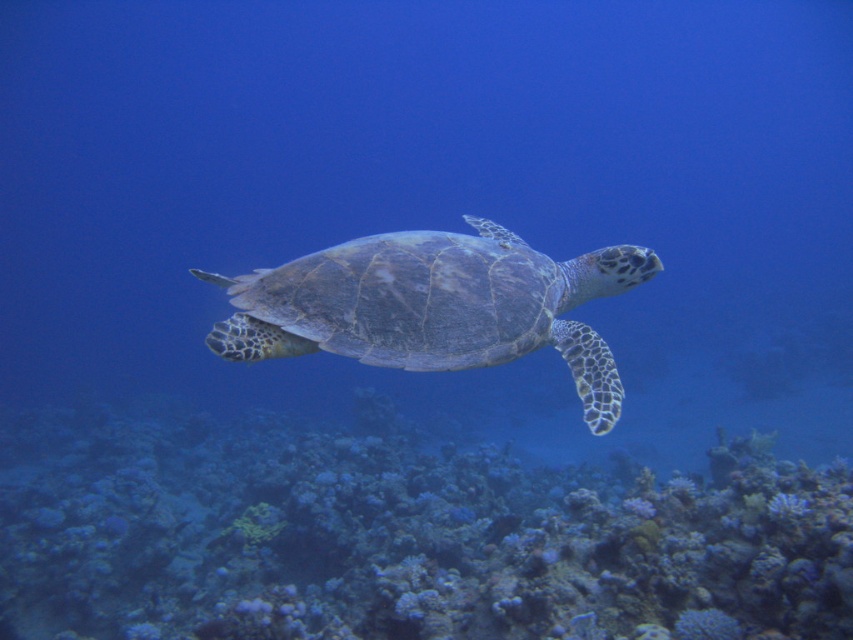
Question: Which object appears closest to the camera in this image?

Choices:
 (A) greenish-gray textured shell at center
 (B) rusty coral reef at center

Answer: (B)

Question: Which point is farther to the camera?

Choices:
 (A) greenish-gray textured shell at center
 (B) rusty coral reef at center

Answer: (A)

Question: Can you confirm if rusty coral reef at center is positioned to the right of greenish-gray textured shell at center?

Choices:
 (A) no
 (B) yes

Answer: (A)

Question: Is rusty coral reef at center further to camera compared to greenish-gray textured shell at center?

Choices:
 (A) yes
 (B) no

Answer: (B)

Question: Which of the following is the farthest from the observer?

Choices:
 (A) greenish-gray textured shell at center
 (B) rusty coral reef at center

Answer: (A)

Question: Can you confirm if rusty coral reef at center is positioned to the left of greenish-gray textured shell at center?

Choices:
 (A) yes
 (B) no

Answer: (A)